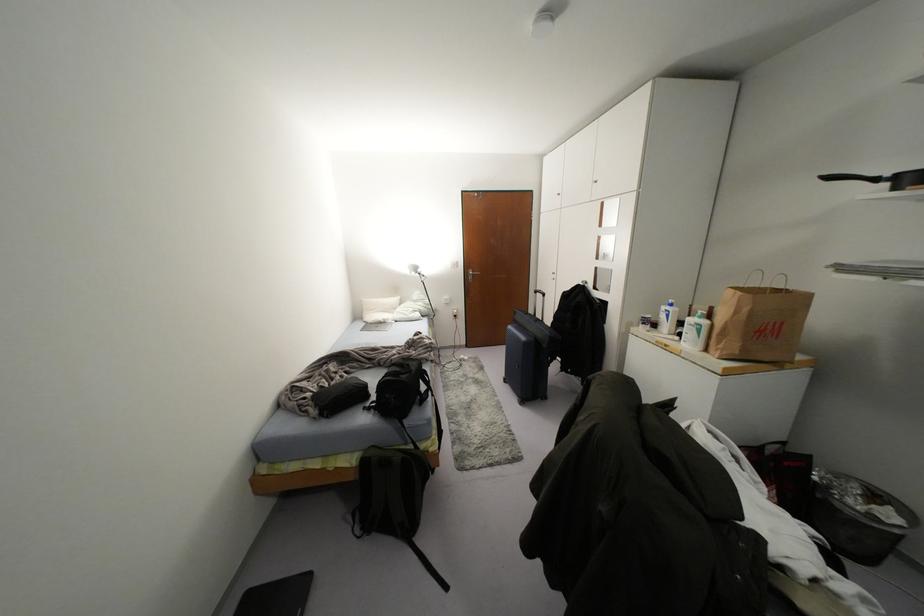
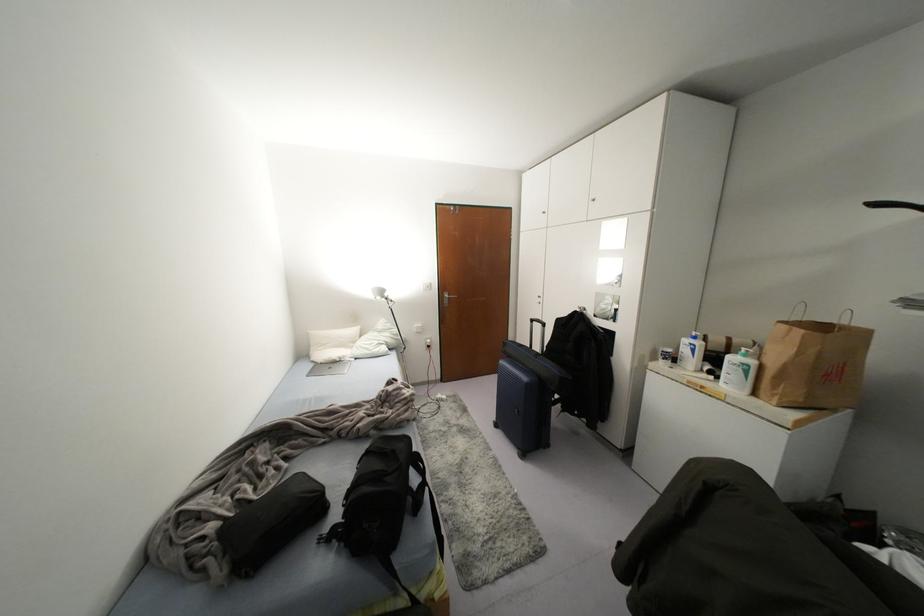
In the second image, find the point that corresponds to the point at 407,363 in the first image.

(393, 451)